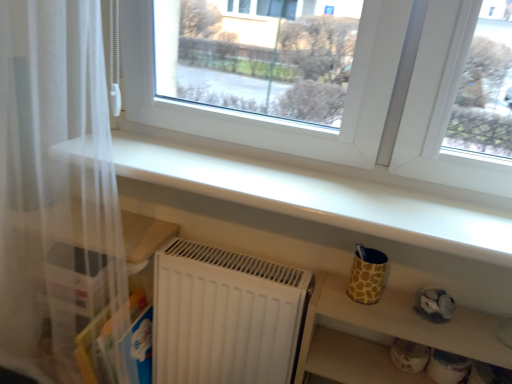
Question: In which direction should I rotate to look at white glossy shelf at upper center, the 1th shelf in the top-to-bottom sequence?

Choices:
 (A) right
 (B) left

Answer: (A)

Question: Considering the relative positions of matte yellow cup at lower right, the 1th shelf ordered from the bottom, and white glossy shelf at upper center, the 1th shelf in the top-to-bottom sequence, in the image provided, is matte yellow cup at lower right, the 1th shelf ordered from the bottom, to the right of white glossy shelf at upper center, the 1th shelf in the top-to-bottom sequence, from the viewer's perspective?

Choices:
 (A) no
 (B) yes

Answer: (B)

Question: Is matte yellow cup at lower right, which is the 2th shelf from top to bottom, at the left side of white glossy shelf at upper center, which appears as the 2th shelf when ordered from the bottom?

Choices:
 (A) yes
 (B) no

Answer: (B)

Question: Considering the relative sizes of matte yellow cup at lower right, the 1th shelf ordered from the bottom, and white glossy shelf at upper center, which appears as the 2th shelf when ordered from the bottom, in the image provided, is matte yellow cup at lower right, the 1th shelf ordered from the bottom, thinner than white glossy shelf at upper center, which appears as the 2th shelf when ordered from the bottom,?

Choices:
 (A) yes
 (B) no

Answer: (A)

Question: Is matte yellow cup at lower right, the 1th shelf ordered from the bottom, far away from white glossy shelf at upper center, which appears as the 2th shelf when ordered from the bottom?

Choices:
 (A) yes
 (B) no

Answer: (B)

Question: From a real-world perspective, does matte yellow cup at lower right, the 1th shelf ordered from the bottom, stand above white glossy shelf at upper center, which appears as the 2th shelf when ordered from the bottom?

Choices:
 (A) yes
 (B) no

Answer: (B)

Question: Is matte yellow cup at lower right, the 1th shelf ordered from the bottom, facing towards white glossy shelf at upper center, which appears as the 2th shelf when ordered from the bottom?

Choices:
 (A) yes
 (B) no

Answer: (B)

Question: Are white sheer curtain at left and white glossy shelf at upper center, which appears as the 2th shelf when ordered from the bottom, far apart?

Choices:
 (A) yes
 (B) no

Answer: (B)

Question: Considering the relative sizes of white sheer curtain at left and white glossy shelf at upper center, which appears as the 2th shelf when ordered from the bottom, in the image provided, is white sheer curtain at left taller than white glossy shelf at upper center, which appears as the 2th shelf when ordered from the bottom,?

Choices:
 (A) yes
 (B) no

Answer: (A)

Question: From a real-world perspective, does white sheer curtain at left sit lower than white glossy shelf at upper center, the 1th shelf in the top-to-bottom sequence?

Choices:
 (A) yes
 (B) no

Answer: (A)

Question: Considering the relative sizes of white sheer curtain at left and white glossy shelf at upper center, which appears as the 2th shelf when ordered from the bottom, in the image provided, is white sheer curtain at left bigger than white glossy shelf at upper center, which appears as the 2th shelf when ordered from the bottom,?

Choices:
 (A) yes
 (B) no

Answer: (A)

Question: Considering the relative positions of white sheer curtain at left and white glossy shelf at upper center, which appears as the 2th shelf when ordered from the bottom, in the image provided, is white sheer curtain at left to the left of white glossy shelf at upper center, which appears as the 2th shelf when ordered from the bottom, from the viewer's perspective?

Choices:
 (A) no
 (B) yes

Answer: (B)

Question: Does white sheer curtain at left have a lesser width compared to white glossy shelf at upper center, which appears as the 2th shelf when ordered from the bottom?

Choices:
 (A) no
 (B) yes

Answer: (B)

Question: Is white sheer curtain at left wider than matte yellow cup at lower right, which is the 2th shelf from top to bottom?

Choices:
 (A) no
 (B) yes

Answer: (B)